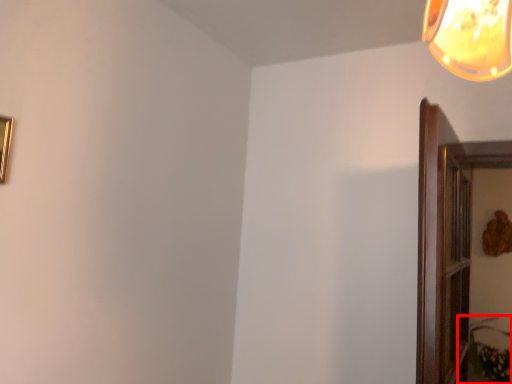
Question: From the image's perspective, what is the correct spatial relationship of plant (annotated by the red box) in relation to picture frame?

Choices:
 (A) above
 (B) below

Answer: (B)